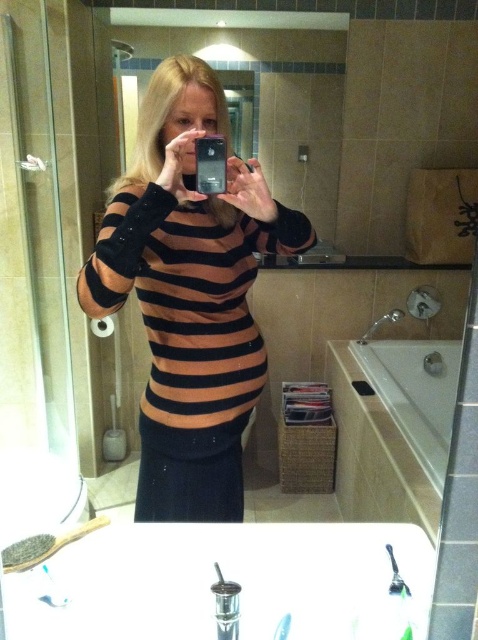
Question: Which of the following is the farthest from the observer?

Choices:
 (A) (457, 352)
 (B) (153, 243)

Answer: (A)

Question: Which point is closer to the camera taking this photo?

Choices:
 (A) (366, 372)
 (B) (184, 180)

Answer: (B)

Question: Can you confirm if black striped sweater at center is positioned below white glossy bathtub at lower right?

Choices:
 (A) no
 (B) yes

Answer: (A)

Question: Does black striped sweater at center appear on the left side of white glossy bathtub at lower right?

Choices:
 (A) no
 (B) yes

Answer: (B)

Question: Which of the following is the closest to the observer?

Choices:
 (A) (415, 419)
 (B) (186, 454)

Answer: (B)

Question: Is black striped sweater at center to the left of white glossy bathtub at lower right from the viewer's perspective?

Choices:
 (A) yes
 (B) no

Answer: (A)